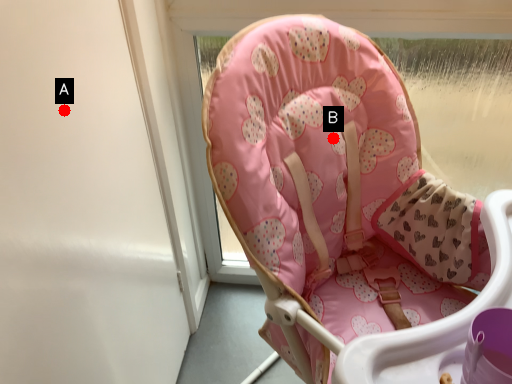
Question: Two points are circled on the image, labeled by A and B beside each circle. Which point is farther from the camera taking this photo?

Choices:
 (A) A is further
 (B) B is further

Answer: (B)